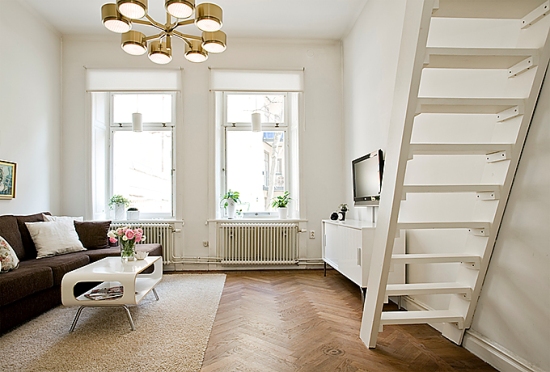
Locate an element on the screen. Image resolution: width=550 pixels, height=372 pixels. brown sofa is located at coordinates (35, 263).